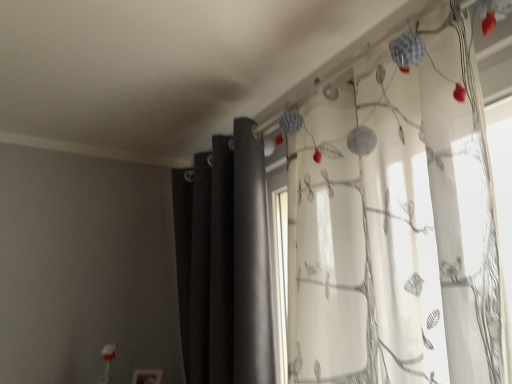
Question: From the image's perspective, relative to dark matte curtain at center, marked as the 1th curtain in a left-to-right arrangement, is white sheer curtain with floral pattern at right, marked as the first curtain in a right-to-left arrangement, above or below?

Choices:
 (A) below
 (B) above

Answer: (B)

Question: Visually, is white sheer curtain with floral pattern at right, which is the second curtain in left-to-right order, positioned to the left or to the right of dark matte curtain at center, marked as the 1th curtain in a left-to-right arrangement?

Choices:
 (A) left
 (B) right

Answer: (B)

Question: Considering the positions of white sheer curtain with floral pattern at right, marked as the first curtain in a right-to-left arrangement, and dark matte curtain at center, which appears as the second curtain when viewed from the right, in the image, is white sheer curtain with floral pattern at right, marked as the first curtain in a right-to-left arrangement, wider or thinner than dark matte curtain at center, which appears as the second curtain when viewed from the right,?

Choices:
 (A) wide
 (B) thin

Answer: (A)

Question: Visually, is dark matte curtain at center, which appears as the second curtain when viewed from the right, positioned to the left or to the right of white sheer curtain with floral pattern at right, which is the second curtain in left-to-right order?

Choices:
 (A) right
 (B) left

Answer: (B)

Question: Relative to white sheer curtain with floral pattern at right, which is the second curtain in left-to-right order, is dark matte curtain at center, which appears as the second curtain when viewed from the right, in front or behind?

Choices:
 (A) behind
 (B) front

Answer: (A)

Question: From the image's perspective, is dark matte curtain at center, marked as the 1th curtain in a left-to-right arrangement, located above or below white sheer curtain with floral pattern at right, which is the second curtain in left-to-right order?

Choices:
 (A) below
 (B) above

Answer: (A)

Question: Looking at their shapes, would you say dark matte curtain at center, which appears as the second curtain when viewed from the right, is wider or thinner than white sheer curtain with floral pattern at right, which is the second curtain in left-to-right order?

Choices:
 (A) thin
 (B) wide

Answer: (A)